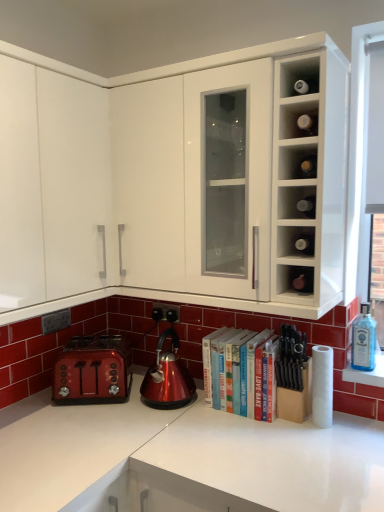
Question: Considering the relative sizes of white glossy cabinet at upper center, the 1th cabinetry when ordered from right to left, and glossy metallic kettle at center in the image provided, is white glossy cabinet at upper center, the 1th cabinetry when ordered from right to left, thinner than glossy metallic kettle at center?

Choices:
 (A) yes
 (B) no

Answer: (B)

Question: From the image's perspective, is white glossy cabinet at upper center, the 1th cabinetry when ordered from right to left, over glossy metallic kettle at center?

Choices:
 (A) yes
 (B) no

Answer: (A)

Question: Is there a large distance between white glossy cabinet at upper center, the second cabinetry positioned from the left, and glossy metallic kettle at center?

Choices:
 (A) no
 (B) yes

Answer: (A)

Question: Is white glossy cabinet at upper center, the 1th cabinetry when ordered from right to left, further to camera compared to glossy metallic kettle at center?

Choices:
 (A) yes
 (B) no

Answer: (B)

Question: Does white glossy cabinet at upper center, the 1th cabinetry when ordered from right to left, have a lesser height compared to glossy metallic kettle at center?

Choices:
 (A) no
 (B) yes

Answer: (A)

Question: Choose the correct answer: Is matte glass wine bottle at center-right, acting as the 2th cabinet starting from the top, inside glossy metallic kettle at center or outside it?

Choices:
 (A) inside
 (B) outside

Answer: (B)

Question: From a real-world perspective, is matte glass wine bottle at center-right, acting as the 2th cabinet starting from the top, above or below glossy metallic kettle at center?

Choices:
 (A) above
 (B) below

Answer: (A)

Question: In terms of height, does matte glass wine bottle at center-right, acting as the second cabinet starting from the bottom, look taller or shorter compared to glossy metallic kettle at center?

Choices:
 (A) short
 (B) tall

Answer: (A)

Question: Considering the positions of point (x=304, y=238) and point (x=188, y=390), is point (x=304, y=238) closer or farther from the camera than point (x=188, y=390)?

Choices:
 (A) farther
 (B) closer

Answer: (B)

Question: Considering the positions of point (157, 316) and point (77, 268), is point (157, 316) closer or farther from the camera than point (77, 268)?

Choices:
 (A) farther
 (B) closer

Answer: (A)

Question: Is black plastic electric outlet at lower center, the second electric outlet in the left-to-right sequence, wider or thinner than white glossy cabinet at upper center, the second cabinetry positioned from the left?

Choices:
 (A) wide
 (B) thin

Answer: (B)

Question: Considering the relative positions of black plastic electric outlet at lower center, which ranks as the 1th electric outlet in back-to-front order, and white glossy cabinet at upper center, the 1th cabinetry when ordered from right to left, in the image provided, is black plastic electric outlet at lower center, which ranks as the 1th electric outlet in back-to-front order, to the left or to the right of white glossy cabinet at upper center, the 1th cabinetry when ordered from right to left,?

Choices:
 (A) left
 (B) right

Answer: (A)

Question: Looking at the image, does black plastic electric outlet at lower center, which ranks as the 1th electric outlet in back-to-front order, seem bigger or smaller compared to white glossy cabinet at upper center, the 1th cabinetry when ordered from right to left?

Choices:
 (A) big
 (B) small

Answer: (B)

Question: Looking at the image, does white glossy cabinet at upper center, the 1th cabinetry when ordered from right to left, seem bigger or smaller compared to black plastic electric outlet at lower center, the second electric outlet in the left-to-right sequence?

Choices:
 (A) big
 (B) small

Answer: (A)

Question: Is white glossy cabinet at upper center, the 1th cabinetry when ordered from right to left, to the left or to the right of black plastic electric outlet at lower center, which is counted as the 1th electric outlet, starting from the right, in the image?

Choices:
 (A) left
 (B) right

Answer: (B)